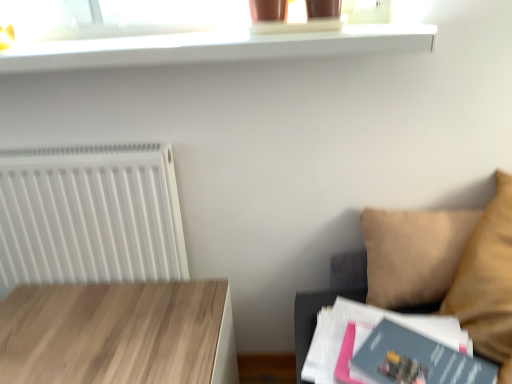
Locate an element on the screen. The width and height of the screenshot is (512, 384). white glossy shelf at upper center is located at coordinates (215, 47).

What do you see at coordinates (90, 215) in the screenshot? This screenshot has width=512, height=384. I see `white plastic radiator at left` at bounding box center [90, 215].

Measure the distance between point (48, 169) and camera.

The distance of point (48, 169) from camera is 1.07 meters.

This screenshot has height=384, width=512. What do you see at coordinates (119, 333) in the screenshot?
I see `light wood table at lower left` at bounding box center [119, 333].

Find the location of `matte gray paperback book at lower right, the first paperback book positioned from the back`. matte gray paperback book at lower right, the first paperback book positioned from the back is located at coordinates (371, 324).

Does white plastic radiator at left appear on the left side of beige fabric couch at right?

Yes.

Does white plastic radiator at left have a greater width compared to beige fabric couch at right?

In fact, white plastic radiator at left might be narrower than beige fabric couch at right.

Does white plastic radiator at left lie behind beige fabric couch at right?

Yes, the depth of white plastic radiator at left is greater than that of beige fabric couch at right.

Is white plastic radiator at left positioned with its back to beige fabric couch at right?

No.

Locate an element on the screen. The width and height of the screenshot is (512, 384). shelf behind the matte gray paperback book at lower right, which is the 2th paperback book from back to front is located at coordinates (215, 47).

Is white glossy shelf at upper center in front of or behind matte gray paperback book at lower right, the first paperback book positioned from the front, in the image?

In the image, white glossy shelf at upper center appears behind matte gray paperback book at lower right, the first paperback book positioned from the front.

Between white glossy shelf at upper center and matte gray paperback book at lower right, the first paperback book positioned from the front, which one appears on the left side from the viewer's perspective?

From the viewer's perspective, white glossy shelf at upper center appears more on the left side.

Considering the sizes of white glossy shelf at upper center and matte gray paperback book at lower right, which is the 2th paperback book from back to front, in the image, is white glossy shelf at upper center wider or thinner than matte gray paperback book at lower right, which is the 2th paperback book from back to front,?

In the image, white glossy shelf at upper center appears to be wider than matte gray paperback book at lower right, which is the 2th paperback book from back to front.

From the image's perspective, which object appears higher, light wood table at lower left or matte gray paperback book at lower right, the second paperback book viewed from the front?

matte gray paperback book at lower right, the second paperback book viewed from the front, appears higher in the image.

Considering the sizes of objects light wood table at lower left and matte gray paperback book at lower right, the second paperback book viewed from the front, in the image provided, who is wider, light wood table at lower left or matte gray paperback book at lower right, the second paperback book viewed from the front,?

light wood table at lower left.

Does light wood table at lower left appear on the right side of matte gray paperback book at lower right, the second paperback book viewed from the front?

Incorrect, light wood table at lower left is not on the right side of matte gray paperback book at lower right, the second paperback book viewed from the front.

Is light wood table at lower left oriented away from matte gray paperback book at lower right, the second paperback book viewed from the front?

No, light wood table at lower left's orientation is not away from matte gray paperback book at lower right, the second paperback book viewed from the front.

Does matte gray paperback book at lower right, the first paperback book positioned from the front, lie behind light wood table at lower left?

No, the depth of matte gray paperback book at lower right, the first paperback book positioned from the front, is less than that of light wood table at lower left.

Based on the photo, is matte gray paperback book at lower right, the first paperback book positioned from the front, outside of light wood table at lower left?

Yes, matte gray paperback book at lower right, the first paperback book positioned from the front, is not within light wood table at lower left.

From the light wood table at lower left, count 2nd paperback books forward and point to it. Please provide its 2D coordinates.

[(417, 359)]

In the scene shown: Is matte gray paperback book at lower right, which is the 2th paperback book from back to front, not near light wood table at lower left?

No, there isn't a large distance between matte gray paperback book at lower right, which is the 2th paperback book from back to front, and light wood table at lower left.

Considering the relative sizes of white glossy shelf at upper center and light wood table at lower left in the image provided, is white glossy shelf at upper center smaller than light wood table at lower left?

Yes.

From a real-world perspective, is white glossy shelf at upper center positioned above or below light wood table at lower left?

white glossy shelf at upper center is situated higher than light wood table at lower left in the real world.

From the image's perspective, is white glossy shelf at upper center above or below light wood table at lower left?

Clearly, from the image's perspective, white glossy shelf at upper center is above light wood table at lower left.

Considering the sizes of matte gray paperback book at lower right, which is the 2th paperback book from back to front, and matte gray paperback book at lower right, the first paperback book positioned from the back, in the image, is matte gray paperback book at lower right, which is the 2th paperback book from back to front, taller or shorter than matte gray paperback book at lower right, the first paperback book positioned from the back,?

In the image, matte gray paperback book at lower right, which is the 2th paperback book from back to front, appears to be shorter than matte gray paperback book at lower right, the first paperback book positioned from the back.

Is matte gray paperback book at lower right, the second paperback book viewed from the front, a part of matte gray paperback book at lower right, the first paperback book positioned from the front?

Definitely not — matte gray paperback book at lower right, the second paperback book viewed from the front, is not inside matte gray paperback book at lower right, the first paperback book positioned from the front.

Considering the positions of objects matte gray paperback book at lower right, the first paperback book positioned from the front, and matte gray paperback book at lower right, the first paperback book positioned from the back, in the image provided, who is more to the left, matte gray paperback book at lower right, the first paperback book positioned from the front, or matte gray paperback book at lower right, the first paperback book positioned from the back,?

Positioned to the left is matte gray paperback book at lower right, the first paperback book positioned from the back.

Is matte gray paperback book at lower right, which is the 2th paperback book from back to front, far from matte gray paperback book at lower right, the first paperback book positioned from the back?

They are positioned close to each other.

Who is more distant, beige fabric couch at right or matte gray paperback book at lower right, the first paperback book positioned from the back?

beige fabric couch at right.

Is point (395, 264) behind point (335, 380)?

Yes, point (395, 264) is behind point (335, 380).

Who is taller, beige fabric couch at right or matte gray paperback book at lower right, the second paperback book viewed from the front?

Standing taller between the two is beige fabric couch at right.

Are beige fabric couch at right and matte gray paperback book at lower right, the second paperback book viewed from the front, far apart?

Actually, beige fabric couch at right and matte gray paperback book at lower right, the second paperback book viewed from the front, are a little close together.

At what (x,y) coordinates should I click in order to perform the action: click on couch lying on the right of white plastic radiator at left. Please return your answer as a coordinate pair (x, y). This screenshot has height=384, width=512. Looking at the image, I should click on (419, 257).

I want to click on the 2nd paperback book in front of the white glossy shelf at upper center, counting from the anchor's position, so click(417, 359).

From the image, which object appears to be farther from white plastic radiator at left, light wood table at lower left or matte gray paperback book at lower right, the second paperback book viewed from the front?

The object further to white plastic radiator at left is matte gray paperback book at lower right, the second paperback book viewed from the front.

Based on their spatial positions, is matte gray paperback book at lower right, the first paperback book positioned from the back, or white plastic radiator at left further from white glossy shelf at upper center?

The object further to white glossy shelf at upper center is matte gray paperback book at lower right, the first paperback book positioned from the back.

Which object lies nearer to the anchor point beige fabric couch at right, light wood table at lower left or matte gray paperback book at lower right, the second paperback book viewed from the front?

Among the two, matte gray paperback book at lower right, the second paperback book viewed from the front, is located nearer to beige fabric couch at right.

Consider the image. Looking at the image, which one is located further to white plastic radiator at left, white glossy shelf at upper center or matte gray paperback book at lower right, which is the 2th paperback book from back to front?

Among the two, matte gray paperback book at lower right, which is the 2th paperback book from back to front, is located further to white plastic radiator at left.

From the image, which object appears to be nearer to matte gray paperback book at lower right, the first paperback book positioned from the back, white plastic radiator at left or matte gray paperback book at lower right, which is the 2th paperback book from back to front?

Based on the image, matte gray paperback book at lower right, which is the 2th paperback book from back to front, appears to be nearer to matte gray paperback book at lower right, the first paperback book positioned from the back.

From the image, which object appears to be nearer to light wood table at lower left, beige fabric couch at right or matte gray paperback book at lower right, the second paperback book viewed from the front?

matte gray paperback book at lower right, the second paperback book viewed from the front, is positioned closer to the anchor light wood table at lower left.

Considering their positions, is white plastic radiator at left positioned further to beige fabric couch at right than matte gray paperback book at lower right, the first paperback book positioned from the back?

Among the two, white plastic radiator at left is located further to beige fabric couch at right.

Which object lies nearer to the anchor point white glossy shelf at upper center, matte gray paperback book at lower right, the first paperback book positioned from the front, or white plastic radiator at left?

white plastic radiator at left is positioned closer to the anchor white glossy shelf at upper center.

In order to click on shelf between white plastic radiator at left and matte gray paperback book at lower right, which is the 2th paperback book from back to front, in the horizontal direction in this screenshot , I will do `click(215, 47)`.

Image resolution: width=512 pixels, height=384 pixels. What are the coordinates of `paperback book located between white plastic radiator at left and matte gray paperback book at lower right, the first paperback book positioned from the front, in the left-right direction` in the screenshot? It's located at (371, 324).

The width and height of the screenshot is (512, 384). What are the coordinates of `radiator between white glossy shelf at upper center and light wood table at lower left vertically` in the screenshot? It's located at (90, 215).

The height and width of the screenshot is (384, 512). Find the location of `table between white plastic radiator at left and matte gray paperback book at lower right, the first paperback book positioned from the front`. table between white plastic radiator at left and matte gray paperback book at lower right, the first paperback book positioned from the front is located at coordinates point(119,333).